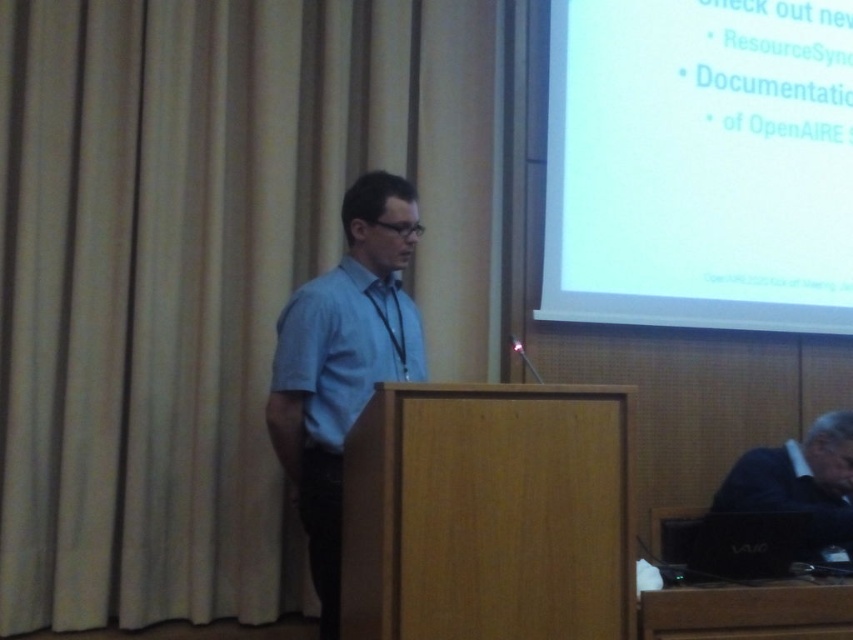
Which of these two, light blue cotton dress shirt at center or black plastic laptop at lower right, stands taller?

With more height is light blue cotton dress shirt at center.

Is light blue cotton dress shirt at center behind black plastic laptop at lower right?

No.

Measure the distance between point (289, 316) and camera.

Point (289, 316) and camera are 2.27 meters apart from each other.

Where is `light blue cotton dress shirt at center`? The width and height of the screenshot is (853, 640). light blue cotton dress shirt at center is located at coordinates (344, 346).

Which is above, white glossy screen at upper right or light blue shirt at center?

white glossy screen at upper right

Who is more forward, (x=607, y=308) or (x=325, y=460)?

Point (x=325, y=460) is in front.

What do you see at coordinates (699, 164) in the screenshot? The height and width of the screenshot is (640, 853). I see `white glossy screen at upper right` at bounding box center [699, 164].

Locate an element on the screen. white glossy screen at upper right is located at coordinates (699, 164).

Which is more to the left, light blue shirt at center or black plastic laptop at lower right?

light blue shirt at center is more to the left.

Locate an element on the screen. The width and height of the screenshot is (853, 640). light blue shirt at center is located at coordinates (341, 364).

You are a GUI agent. You are given a task and a screenshot of the screen. Output one action in this format:
    pyautogui.click(x=<x>, y=<y>)
    Task: Click on the light blue shirt at center
    The width and height of the screenshot is (853, 640).
    Given the screenshot: What is the action you would take?
    pyautogui.click(x=341, y=364)